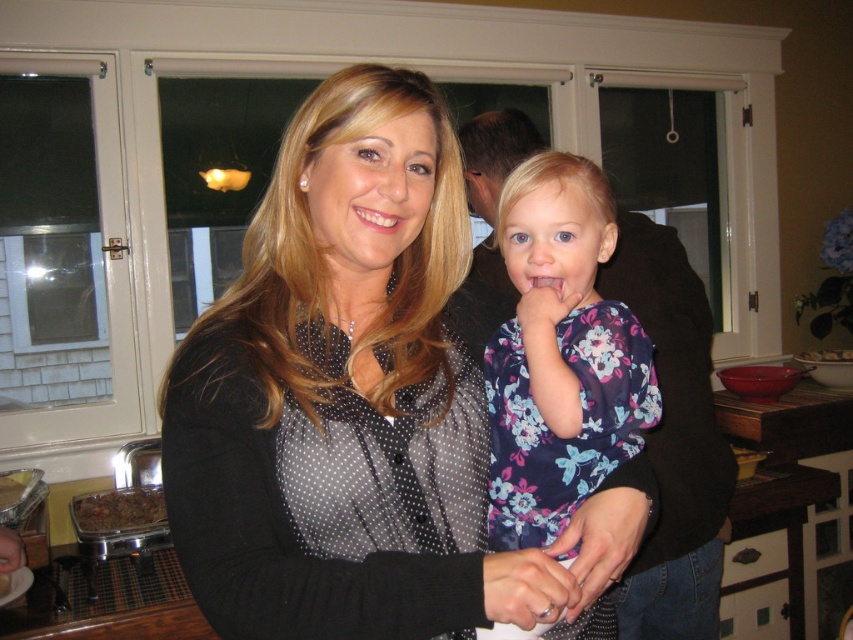
You are a dentist examining a patient who has brown crumbly food at lower left and matte white teeth at center. Which object is larger?

The brown crumbly food at lower left is bigger than the matte white teeth at center.

You are a photographer setting up for a family portrait. You have a camera with a lens that can focus on objects within a 1.2 meter width. The black dotted shirt at center and the white glossy bowl at upper right are in your frame. Based on their widths, can both objects fit within the camera lens focus width?

The black dotted shirt at center might be wider than white glossy bowl at upper right, so it depends on the exact width of the shirt. If the shirt is wider than 1.2 meters, then it won me. If it is narrower, both could fit.